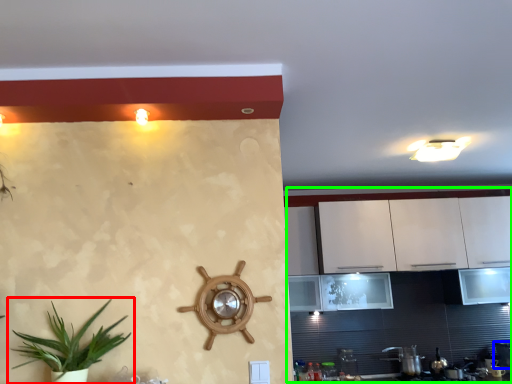
Question: Which object is positioned closest to houseplant (highlighted by a red box)? Select from appliance (highlighted by a blue box) and dresser (highlighted by a green box).

Choices:
 (A) appliance
 (B) dresser

Answer: (B)